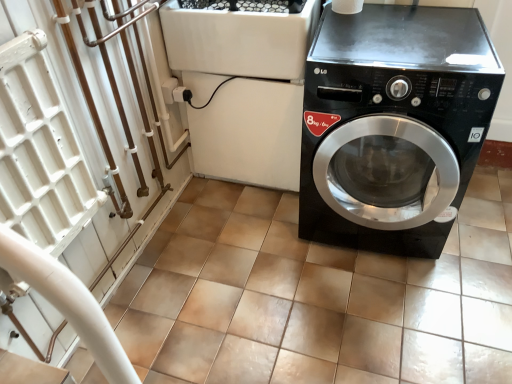
I want to click on black plastic washing machine at center, so click(x=243, y=87).

How different are the orientations of brown tile at center and black glossy washing machine at right in degrees?

brown tile at center and black glossy washing machine at right are facing 90.6 degrees away from each other.

From a real-world perspective, does brown tile at center sit lower than black glossy washing machine at right?

Correct, in the physical world, brown tile at center is lower than black glossy washing machine at right.

Which is closer to the camera, [179,358] or [305,123]?

Point [179,358] is positioned farther from the camera compared to point [305,123].

Locate an element on the screen. tile that is in front of the black glossy washing machine at right is located at coordinates (316, 297).

Do you think brown tile at center is within black plastic washing machine at center, or outside of it?

brown tile at center is located beyond the bounds of black plastic washing machine at center.

How many degrees apart are the facing directions of brown tile at center and black plastic washing machine at center?

90.5 degrees separate the facing orientations of brown tile at center and black plastic washing machine at center.

Can you confirm if brown tile at center is wider than black plastic washing machine at center?

Yes.

Which is behind, brown tile at center or black plastic washing machine at center?

black plastic washing machine at center.

Is black glossy washing machine at right directly adjacent to brown tile at center?

No, black glossy washing machine at right is not in contact with brown tile at center.

Is point (451, 127) positioned before point (436, 365)?

Yes.

Between black glossy washing machine at right and brown tile at center, which one has more height?

With more height is black glossy washing machine at right.

Would you say black glossy washing machine at right is inside or outside brown tile at center?

The correct answer is: outside.

Which object is further away from the camera taking this photo, black plastic washing machine at center or black glossy washing machine at right?

black plastic washing machine at center is more distant.

Who is bigger, black plastic washing machine at center or black glossy washing machine at right?

black glossy washing machine at right is bigger.

Is black plastic washing machine at center taller or shorter than black glossy washing machine at right?

In the image, black plastic washing machine at center appears to be shorter than black glossy washing machine at right.

Which object is positioned more to the left, black glossy washing machine at right or black plastic washing machine at center?

black plastic washing machine at center.

Would you consider black glossy washing machine at right to be distant from black plastic washing machine at center?

No, black glossy washing machine at right is in close proximity to black plastic washing machine at center.

Considering the relative sizes of black glossy washing machine at right and black plastic washing machine at center in the image provided, is black glossy washing machine at right taller than black plastic washing machine at center?

Correct, black glossy washing machine at right is much taller as black plastic washing machine at center.

Which point is more forward, (378,158) or (207,90)?

The point (207,90) is closer.

Can you tell me how much black plastic washing machine at center and brown tile at center differ in facing direction?

black plastic washing machine at center and brown tile at center are facing 90.5 degrees away from each other.

Between black plastic washing machine at center and brown tile at center, which one has smaller width?

Thinner between the two is black plastic washing machine at center.

Which point is more distant from viewer, (184, 85) or (444, 335)?

The point (184, 85) is behind.

Can you confirm if black plastic washing machine at center is shorter than brown tile at center?

No, black plastic washing machine at center is not shorter than brown tile at center.

I want to click on tile below the black glossy washing machine at right (from a real-world perspective), so click(316, 297).

Find the location of `tile below the black plastic washing machine at center (from the image's perspective)`. tile below the black plastic washing machine at center (from the image's perspective) is located at coordinates (316, 297).

Based on their spatial positions, is brown tile at center or black plastic washing machine at center closer to black glossy washing machine at right?

black plastic washing machine at center.

From the image, which object appears to be nearer to brown tile at center, black plastic washing machine at center or black glossy washing machine at right?

The object closer to brown tile at center is black glossy washing machine at right.

Looking at the image, which one is located further to brown tile at center, black glossy washing machine at right or black plastic washing machine at center?

Based on the image, black plastic washing machine at center appears to be further to brown tile at center.

Considering their positions, is brown tile at center positioned closer to black plastic washing machine at center than black glossy washing machine at right?

The object closer to black plastic washing machine at center is black glossy washing machine at right.

Which object lies nearer to the anchor point black plastic washing machine at center, black glossy washing machine at right or brown tile at center?

Among the two, black glossy washing machine at right is located nearer to black plastic washing machine at center.

Estimate the real-world distances between objects in this image. Which object is further from black glossy washing machine at right, black plastic washing machine at center or brown tile at center?

Result: brown tile at center.

I want to click on washing machine located between brown tile at center and black plastic washing machine at center in the depth direction, so click(393, 122).